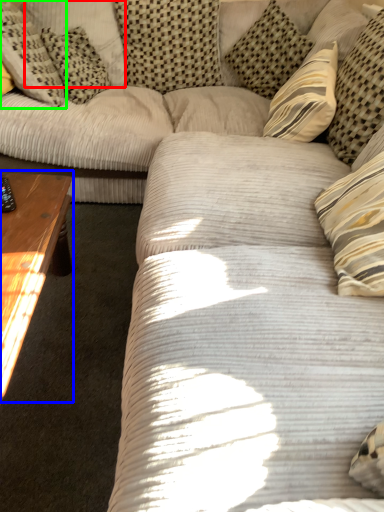
Question: Estimate the real-world distances between objects in this image. Which object is farther from pillow (highlighted by a red box), coffee table (highlighted by a blue box) or pillow (highlighted by a green box)?

Choices:
 (A) coffee table
 (B) pillow

Answer: (A)